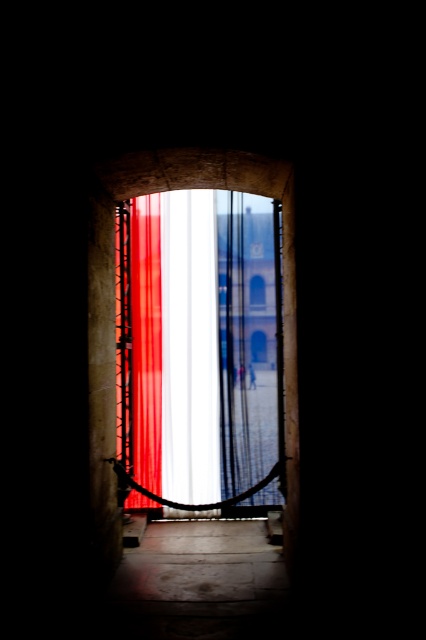
Question: Observing the image, what is the correct spatial positioning of translucent fabric curtain at center in reference to smooth red curtain at center?

Choices:
 (A) left
 (B) right

Answer: (B)

Question: Is translucent fabric curtain at center closer to camera compared to smooth red curtain at center?

Choices:
 (A) no
 (B) yes

Answer: (A)

Question: Which point is farther to the camera?

Choices:
 (A) translucent fabric curtain at center
 (B) smooth red curtain at center

Answer: (A)

Question: Can you confirm if translucent fabric curtain at center is smaller than smooth red curtain at center?

Choices:
 (A) no
 (B) yes

Answer: (A)

Question: Among these points, which one is nearest to the camera?

Choices:
 (A) (264, 456)
 (B) (154, 224)

Answer: (A)